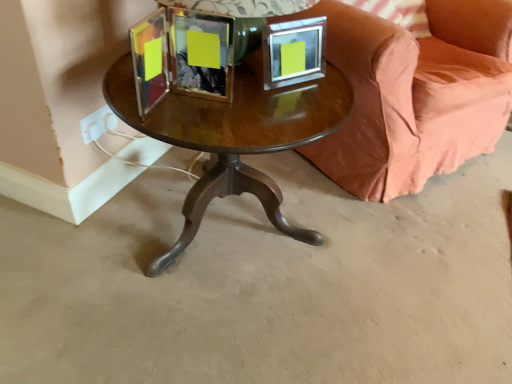
Question: Is pink fabric pillow at upper right thinner than metallic silver picture frame at upper center?

Choices:
 (A) yes
 (B) no

Answer: (B)

Question: Does pink fabric pillow at upper right have a smaller size compared to metallic silver picture frame at upper center?

Choices:
 (A) yes
 (B) no

Answer: (B)

Question: Does pink fabric pillow at upper right turn towards metallic silver picture frame at upper center?

Choices:
 (A) no
 (B) yes

Answer: (A)

Question: Considering the relative positions of pink fabric pillow at upper right and metallic silver picture frame at upper center in the image provided, is pink fabric pillow at upper right to the left of metallic silver picture frame at upper center from the viewer's perspective?

Choices:
 (A) yes
 (B) no

Answer: (B)

Question: Considering the relative sizes of pink fabric pillow at upper right and metallic silver picture frame at upper center in the image provided, is pink fabric pillow at upper right taller than metallic silver picture frame at upper center?

Choices:
 (A) yes
 (B) no

Answer: (A)

Question: Could metallic silver picture frame at upper center be considered to be inside pink fabric pillow at upper right?

Choices:
 (A) no
 (B) yes

Answer: (A)

Question: Is pink fabric pillow at upper right thinner than velvet coral couch at center?

Choices:
 (A) no
 (B) yes

Answer: (B)

Question: Is pink fabric pillow at upper right further to the viewer compared to velvet coral couch at center?

Choices:
 (A) no
 (B) yes

Answer: (B)

Question: From a real-world perspective, does pink fabric pillow at upper right sit lower than velvet coral couch at center?

Choices:
 (A) yes
 (B) no

Answer: (B)

Question: Can you confirm if pink fabric pillow at upper right is positioned to the left of velvet coral couch at center?

Choices:
 (A) yes
 (B) no

Answer: (B)

Question: Is pink fabric pillow at upper right taller than velvet coral couch at center?

Choices:
 (A) yes
 (B) no

Answer: (B)

Question: Is pink fabric pillow at upper right aimed at velvet coral couch at center?

Choices:
 (A) yes
 (B) no

Answer: (A)

Question: Is metallic silver picture frame at upper center outside of velvet coral couch at center?

Choices:
 (A) no
 (B) yes

Answer: (B)